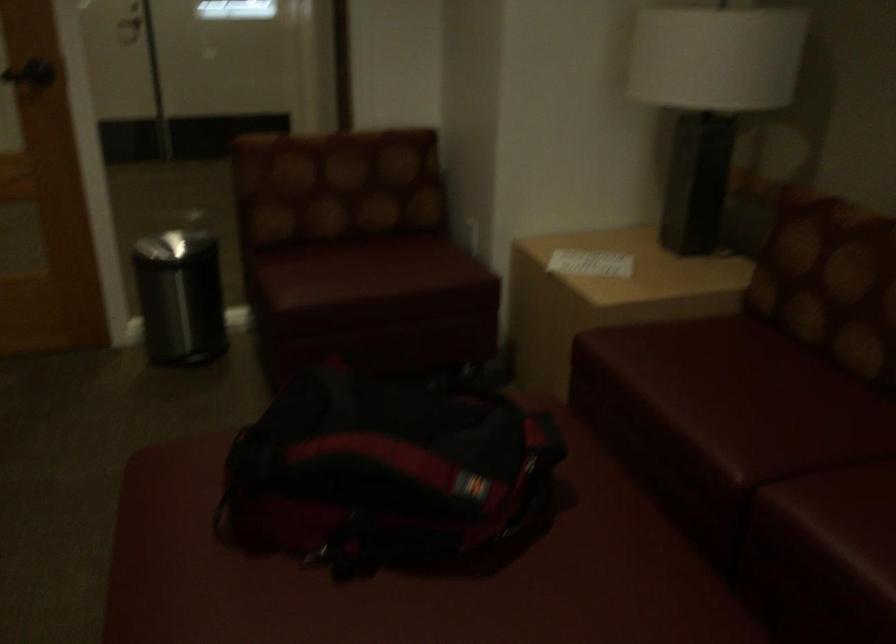
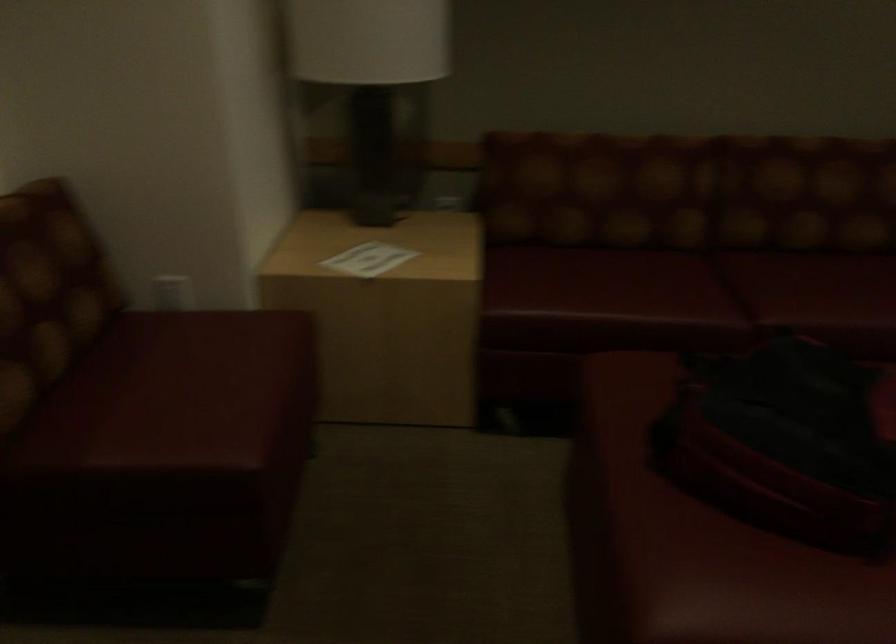
Locate, in the second image, the point that corresponds to point (338, 261) in the first image.

(175, 393)